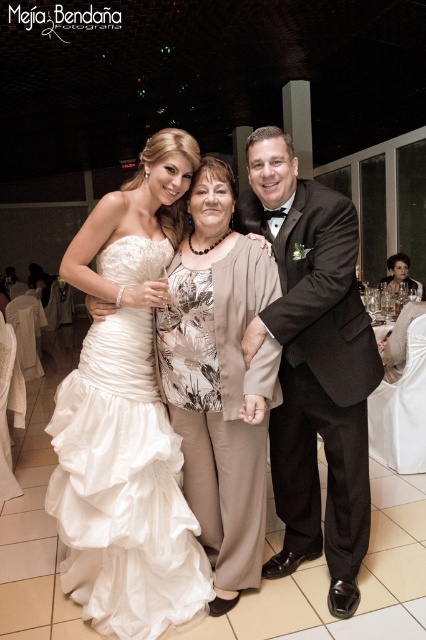
Which is below, black satin suit at center or floral print blouse at center?

Positioned lower is floral print blouse at center.

Does black satin suit at center appear over floral print blouse at center?

Yes, black satin suit at center is above floral print blouse at center.

Consider the image. Who is more forward, (351, 508) or (239, 451)?

Point (239, 451)

You are a GUI agent. You are given a task and a screenshot of the screen. Output one action in this format:
    pyautogui.click(x=<x>, y=<y>)
    Task: Click on the black satin suit at center
    
    Given the screenshot: What is the action you would take?
    pyautogui.click(x=313, y=364)

Based on the photo, which is below, white satin dress at left or black satin suit at center?

white satin dress at left

Is white satin dress at left positioned before black satin suit at center?

That is True.

The width and height of the screenshot is (426, 640). Find the location of `white satin dress at left`. white satin dress at left is located at coordinates (123, 488).

Can you confirm if black satin suit at center is taller than matte black dress at center?

Result: Yes, black satin suit at center is taller than matte black dress at center.

Which is below, black satin suit at center or matte black dress at center?

black satin suit at center is lower down.

What are the coordinates of `black satin suit at center` in the screenshot? It's located at (313, 364).